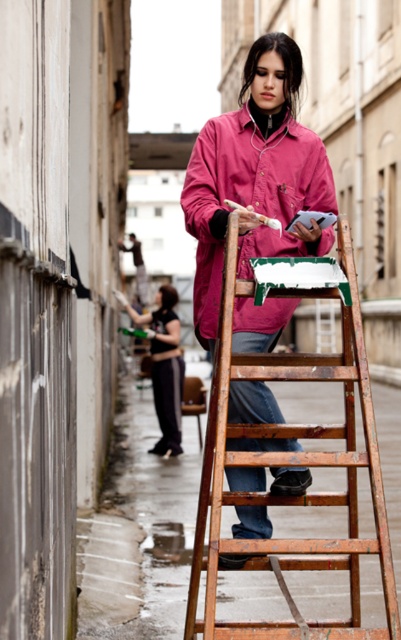
Between pink matte jacket at center and black fabric pants at lower center, which one appears on the right side from the viewer's perspective?

From the viewer's perspective, pink matte jacket at center appears more on the right side.

Is pink matte jacket at center taller than black fabric pants at lower center?

Indeed, pink matte jacket at center has a greater height compared to black fabric pants at lower center.

Is point (188, 200) positioned after point (168, 346)?

No, (188, 200) is closer to viewer.

You are a GUI agent. You are given a task and a screenshot of the screen. Output one action in this format:
    pyautogui.click(x=<x>, y=<y>)
    Task: Click on the pink matte jacket at center
    This screenshot has width=401, height=640.
    Given the screenshot: What is the action you would take?
    251,168

Who is higher up, matte pink jacket at center or black fabric pants at lower center?

matte pink jacket at center

Which is behind, point (200, 209) or point (153, 387)?

Positioned behind is point (153, 387).

Is point (287, 317) closer to camera compared to point (157, 392)?

Yes, it is in front of point (157, 392).

What are the coordinates of `matte pink jacket at center` in the screenshot? It's located at (249, 198).

Can you confirm if pink matte jacket at center is taller than wooden at center?

Indeed, pink matte jacket at center has a greater height compared to wooden at center.

Is pink matte jacket at center below wooden at center?

Actually, pink matte jacket at center is above wooden at center.

Is point (275, 140) closer to viewer compared to point (214, 618)?

No, (275, 140) is further to viewer.

This screenshot has width=401, height=640. What are the coordinates of `pink matte jacket at center` in the screenshot? It's located at (251, 168).